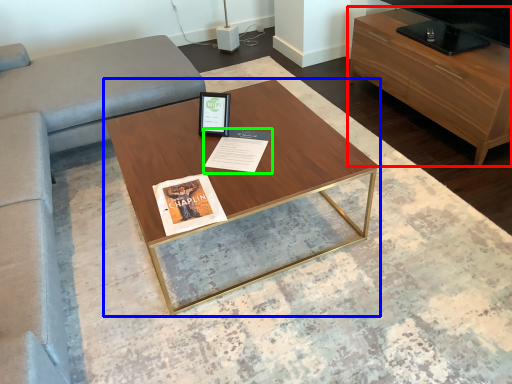
Question: Estimate the real-world distances between objects in this image. Which object is farther from table (highlighted by a red box), coffee table (highlighted by a blue box) or magazine (highlighted by a green box)?

Choices:
 (A) coffee table
 (B) magazine

Answer: (B)